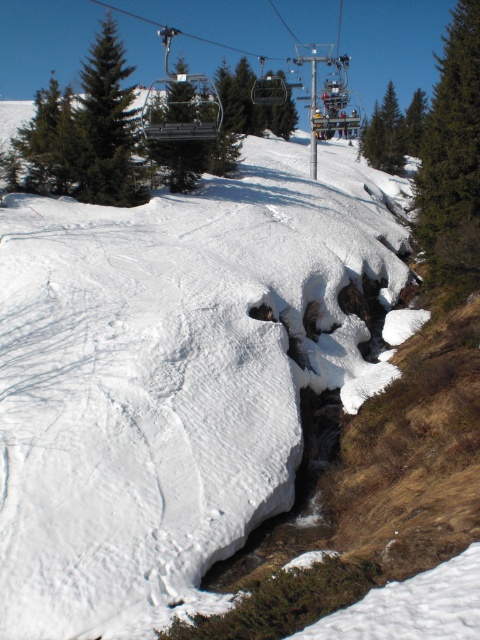
You are planning a hiking route through the snowy mountain landscape. You need to decide whether to pass between the green textured pine at right and the green matte pine at upper left. Based on their positions, which direction should you head to stay between them?

To stay between the green textured pine at right and the green matte pine at upper left, you should head towards the lower middle area since the green textured pine at right is positioned below the green matte pine at upper left.

You are standing at the bottom of the slope and want to locate the green textured pine at right. According to the coordinates provided, where should you look relative to your current position?

The green textured pine at right is located at coordinates point 0.245 on the x axis and 0.944 on the y axis, so you should look to the right side and slightly upwards from your current position at the bottom of the slope.

You are planning to install a new ski lift between the green textured pine at right and the green matte pine at upper left. Given that the maximum distance between two support poles for a safe ski lift is 140 meters, will the distance between these two pines allow for a direct installation without additional support poles?

The green textured pine at right and the green matte pine at upper left are 141.47 meters apart. Since the maximum safe distance between two support poles is 140 meters, the distance exceeds the limit by 1.47 meters. Therefore, additional support poles would be required between them to ensure safety.